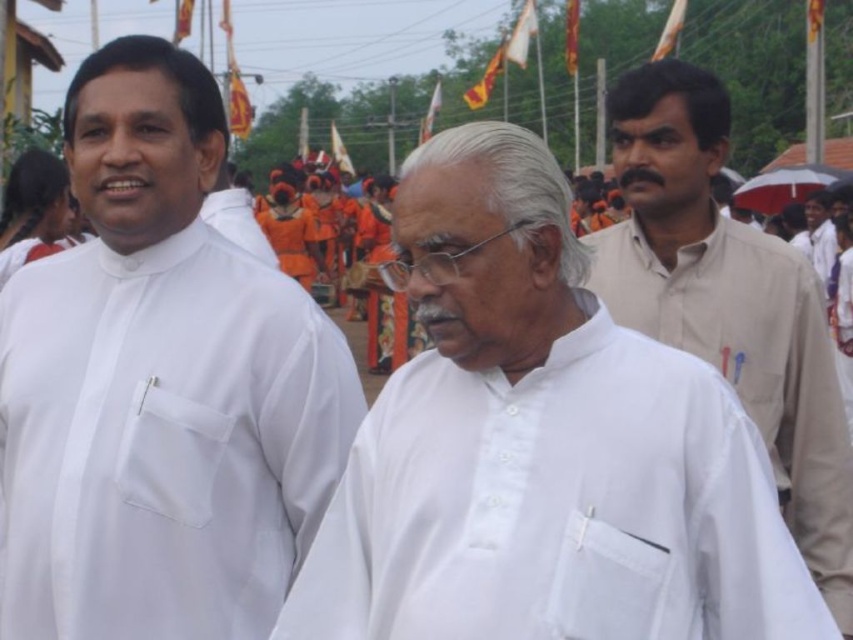
Question: Is white matte shirt at left to the right of white cotton shirt at right from the viewer's perspective?

Choices:
 (A) no
 (B) yes

Answer: (A)

Question: Estimate the real-world distances between objects in this image. Which object is closer to the white matte shirt at left?

Choices:
 (A) white cotton shirt at center
 (B) white cotton shirt at right
 (C) beige cotton shirt at right

Answer: (A)

Question: Can you confirm if white matte shirt at left is wider than white cotton shirt at right?

Choices:
 (A) no
 (B) yes

Answer: (A)

Question: Which of the following is the closest to the observer?

Choices:
 (A) (822, 211)
 (B) (96, 435)

Answer: (B)

Question: Which point is farther from the camera taking this photo?

Choices:
 (A) (451, 396)
 (B) (824, 260)
 (C) (643, 282)

Answer: (B)

Question: Does white matte shirt at left appear over white cotton shirt at center?

Choices:
 (A) no
 (B) yes

Answer: (B)